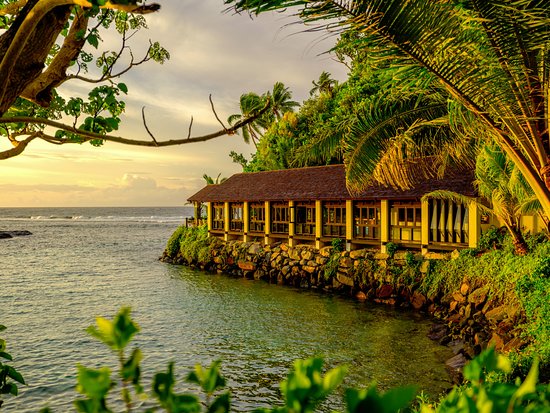
Find the location of a particular element. The width and height of the screenshot is (550, 413). window is located at coordinates (406, 214), (366, 212), (333, 211), (304, 212), (274, 212), (255, 212), (233, 212), (217, 214).